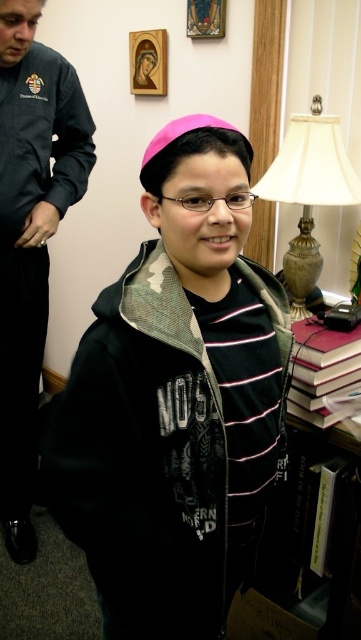
Question: Is pink matte hat at center to the left of wooden frame at upper center from the viewer's perspective?

Choices:
 (A) no
 (B) yes

Answer: (A)

Question: Is wooden frame at upper center bigger than wooden stained glass window at upper center?

Choices:
 (A) yes
 (B) no

Answer: (A)

Question: Which point is farther to the camera?

Choices:
 (A) (341, 353)
 (B) (325, 161)
 (C) (146, 68)
 (D) (219, 13)

Answer: (C)

Question: Which of these objects is positioned farthest from the wooden frame at upper center?

Choices:
 (A) hardcover book at lower right
 (B) pink matte hat at center
 (C) wooden stained glass window at upper center

Answer: (A)

Question: Among these objects, which one is nearest to the camera?

Choices:
 (A) hardcover book at lower right
 (B) pink matte hat at center
 (C) wooden frame at upper center
 (D) maroon leather book at lower right

Answer: (B)

Question: Is maroon leather book at lower right bigger than wooden stained glass window at upper center?

Choices:
 (A) yes
 (B) no

Answer: (A)